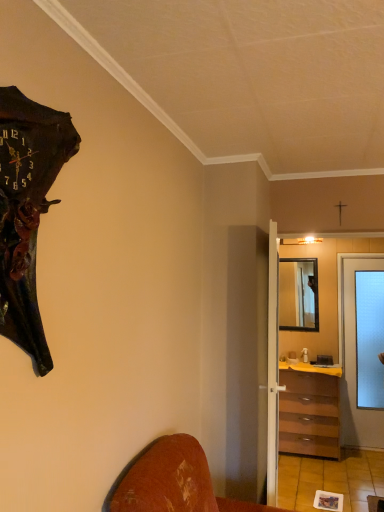
Measure the distance between transparent frosted glass screen door at center-right and camera.

transparent frosted glass screen door at center-right and camera are 14.12 feet apart.

Describe the element at coordinates (27, 210) in the screenshot. I see `dark brown wooden wall clock at left` at that location.

The height and width of the screenshot is (512, 384). What do you see at coordinates (311, 367) in the screenshot?
I see `yellow laminate counter top at center` at bounding box center [311, 367].

The image size is (384, 512). What do you see at coordinates (362, 353) in the screenshot?
I see `transparent glass door at right, the 1th door when ordered from back to front` at bounding box center [362, 353].

The width and height of the screenshot is (384, 512). In order to click on wooden framed mirror at center in this screenshot , I will do pos(298,294).

Based on the photo, which object is further away from the camera, transparent glass door at right, which appears as the 2th door when viewed from the left, or transparent frosted glass screen door at center-right?

transparent glass door at right, which appears as the 2th door when viewed from the left, is further away from the camera.

Can you confirm if transparent glass door at right, acting as the first door starting from the right, is positioned to the right of transparent frosted glass screen door at center-right?

Indeed, transparent glass door at right, acting as the first door starting from the right, is positioned on the right side of transparent frosted glass screen door at center-right.

Is transparent glass door at right, which is the second door in front-to-back order, taller than transparent frosted glass screen door at center-right?

Incorrect, the height of transparent glass door at right, which is the second door in front-to-back order, is not larger of that of transparent frosted glass screen door at center-right.

Between yellow laminate counter top at center and transparent glass door at right, which appears as the 2th door when viewed from the left, which one has smaller width?

transparent glass door at right, which appears as the 2th door when viewed from the left.

Is yellow laminate counter top at center not inside transparent glass door at right, which appears as the 2th door when viewed from the left?

yellow laminate counter top at center is positioned outside transparent glass door at right, which appears as the 2th door when viewed from the left.

Is yellow laminate counter top at center at the left side of transparent glass door at right, acting as the first door starting from the right?

Yes.

Considering the relative sizes of yellow laminate counter top at center and transparent glass door at right, the 1th door when ordered from back to front, in the image provided, is yellow laminate counter top at center smaller than transparent glass door at right, the 1th door when ordered from back to front,?

Yes, yellow laminate counter top at center is smaller than transparent glass door at right, the 1th door when ordered from back to front.

Does transparent frosted glass screen door at center-right come behind transparent glass door at right, acting as the first door starting from the right?

That is False.

Is transparent frosted glass screen door at center-right looking in the opposite direction of transparent glass door at right, which is the second door in front-to-back order?

transparent frosted glass screen door at center-right is not turned away from transparent glass door at right, which is the second door in front-to-back order.

Is transparent frosted glass screen door at center-right far from transparent glass door at right, the 1th door when ordered from back to front?

No, transparent frosted glass screen door at center-right is not far from transparent glass door at right, the 1th door when ordered from back to front.

Is point (315, 252) behind point (356, 298)?

That is True.

Is transparent frosted glass screen door at center-right oriented towards brown wooden chest of drawers at center-right?

Yes, transparent frosted glass screen door at center-right is facing brown wooden chest of drawers at center-right.

From the image's perspective, does transparent frosted glass screen door at center-right appear lower than brown wooden chest of drawers at center-right?

No, from the image's perspective, transparent frosted glass screen door at center-right is not beneath brown wooden chest of drawers at center-right.

Can you confirm if transparent frosted glass screen door at center-right is positioned to the left of brown wooden chest of drawers at center-right?

Correct, you'll find transparent frosted glass screen door at center-right to the left of brown wooden chest of drawers at center-right.

Is point (335, 290) farther from camera compared to point (312, 392)?

Yes, point (335, 290) is farther from viewer.

Can yellow laminate counter top at center be found inside brown wooden chest of drawers at center-right?

Indeed, yellow laminate counter top at center is located within brown wooden chest of drawers at center-right.

Which point is more distant from viewer, (291, 418) or (290, 360)?

The point (290, 360) is farther.

Is brown wooden chest of drawers at center-right positioned far away from yellow laminate counter top at center?

brown wooden chest of drawers at center-right is near yellow laminate counter top at center, not far away.

Which of these two, brown wooden chest of drawers at center-right or yellow laminate counter top at center, stands shorter?

With less height is yellow laminate counter top at center.

From the image's perspective, is transparent glass door at right, the 1th door when ordered from back to front, below white wooden door at center, placed as the first door when sorted from front to back?

→ Yes, from the image's perspective, transparent glass door at right, the 1th door when ordered from back to front, is beneath white wooden door at center, placed as the first door when sorted from front to back.

This screenshot has width=384, height=512. There is a transparent glass door at right, acting as the first door starting from the right. Identify the location of door above it (from a real-world perspective). (273, 367).

Measure the distance between transparent glass door at right, the 1th door when ordered from back to front, and white wooden door at center, the 1th door from the left.

A distance of 2.08 meters exists between transparent glass door at right, the 1th door when ordered from back to front, and white wooden door at center, the 1th door from the left.

Is transparent glass door at right, which is the second door in front-to-back order, thinner than white wooden door at center, the 2th door positioned from the right?

Yes, transparent glass door at right, which is the second door in front-to-back order, is thinner than white wooden door at center, the 2th door positioned from the right.

Does wooden framed mirror at center turn towards white wooden door at center, placed as the first door when sorted from front to back?

Yes, wooden framed mirror at center faces towards white wooden door at center, placed as the first door when sorted from front to back.

Can you see wooden framed mirror at center touching white wooden door at center, the 2th door in the back-to-front sequence?

No, wooden framed mirror at center is not touching white wooden door at center, the 2th door in the back-to-front sequence.

Identify the location of mirror on the right of the white wooden door at center, the 2th door positioned from the right. (298, 294).

In the scene shown: Considering the relative sizes of wooden framed mirror at center and white wooden door at center, placed as the first door when sorted from front to back, in the image provided, is wooden framed mirror at center shorter than white wooden door at center, placed as the first door when sorted from front to back,?

Yes.

You are a GUI agent. You are given a task and a screenshot of the screen. Output one action in this format:
    pyautogui.click(x=<x>, y=<y>)
    Task: Click on the screen door above the transparent glass door at right, acting as the first door starting from the right (from a real-world perspective)
    
    Given the screenshot: What is the action you would take?
    pyautogui.click(x=335, y=272)

From the image's perspective, count 1st doors upward from the yellow laminate counter top at center and point to it. Please provide its 2D coordinates.

[(362, 353)]

Consider the image. When comparing their distances from dark brown wooden wall clock at left, does white wooden door at center, the 2th door positioned from the right, or transparent frosted glass screen door at center-right seem closer?

white wooden door at center, the 2th door positioned from the right.

Which object lies nearer to the anchor point brown wooden chest of drawers at center-right, yellow laminate counter top at center or white wooden door at center, the 2th door positioned from the right?

Among the two, yellow laminate counter top at center is located nearer to brown wooden chest of drawers at center-right.

When comparing their distances from brown wooden chest of drawers at center-right, does transparent glass door at right, which is the second door in front-to-back order, or dark brown wooden wall clock at left seem closer?

transparent glass door at right, which is the second door in front-to-back order.

Based on their spatial positions, is transparent frosted glass screen door at center-right or yellow laminate counter top at center closer to dark brown wooden wall clock at left?

yellow laminate counter top at center.

Looking at the image, which one is located closer to white wooden door at center, the 2th door positioned from the right, transparent frosted glass screen door at center-right or wooden framed mirror at center?

The object closer to white wooden door at center, the 2th door positioned from the right, is wooden framed mirror at center.

Estimate the real-world distances between objects in this image. Which object is closer to transparent glass door at right, the 1th door when ordered from back to front, yellow laminate counter top at center or dark brown wooden wall clock at left?

The object closer to transparent glass door at right, the 1th door when ordered from back to front, is yellow laminate counter top at center.

Considering their positions, is transparent frosted glass screen door at center-right positioned closer to dark brown wooden wall clock at left than wooden framed mirror at center?

transparent frosted glass screen door at center-right is closer to dark brown wooden wall clock at left.

Estimate the real-world distances between objects in this image. Which object is further from brown wooden chest of drawers at center-right, transparent glass door at right, which is the second door in front-to-back order, or white wooden door at center, the 1th door from the left?

Based on the image, white wooden door at center, the 1th door from the left, appears to be further to brown wooden chest of drawers at center-right.

You are a GUI agent. You are given a task and a screenshot of the screen. Output one action in this format:
    pyautogui.click(x=<x>, y=<y>)
    Task: Click on the counter top located between dark brown wooden wall clock at left and transparent glass door at right, which appears as the 2th door when viewed from the left, in the depth direction
    Image resolution: width=384 pixels, height=512 pixels.
    Given the screenshot: What is the action you would take?
    pyautogui.click(x=311, y=367)

This screenshot has width=384, height=512. Find the location of `counter top between white wooden door at center, placed as the first door when sorted from front to back, and wooden framed mirror at center from front to back`. counter top between white wooden door at center, placed as the first door when sorted from front to back, and wooden framed mirror at center from front to back is located at coordinates (311, 367).

You are a GUI agent. You are given a task and a screenshot of the screen. Output one action in this format:
    pyautogui.click(x=<x>, y=<y>)
    Task: Click on the screen door between white wooden door at center, the 2th door positioned from the right, and wooden framed mirror at center, along the z-axis
    
    Given the screenshot: What is the action you would take?
    pyautogui.click(x=335, y=272)

Find the location of a particular element. The image size is (384, 512). the chest of drawers located between transparent frosted glass screen door at center-right and yellow laminate counter top at center in the depth direction is located at coordinates (309, 414).